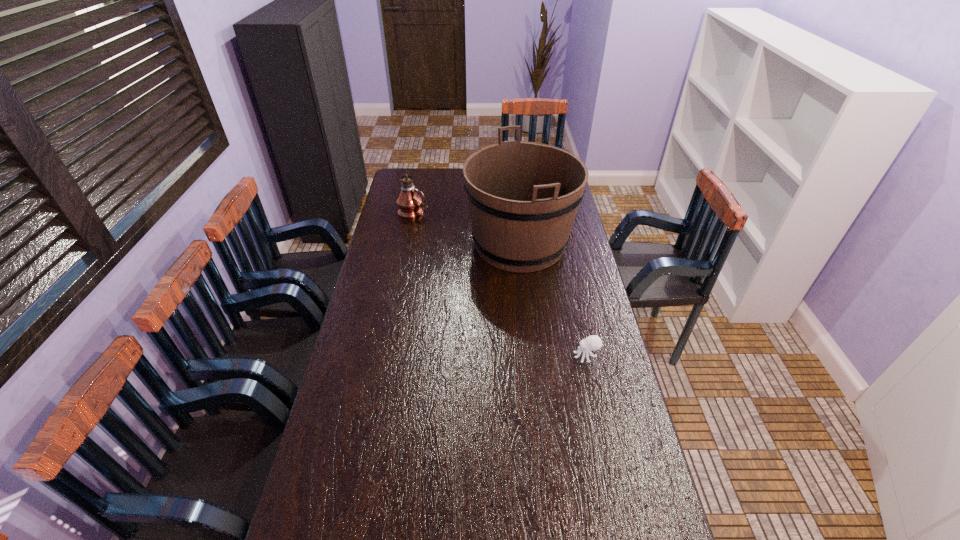
Find the location of a particular element. the tallest object is located at coordinates (523, 197).

Where is `the second shortest object`? the second shortest object is located at coordinates (410, 203).

Where is `the leftmost object`? The image size is (960, 540). the leftmost object is located at coordinates click(x=410, y=203).

You are a GUI agent. You are given a task and a screenshot of the screen. Output one action in this format:
    pyautogui.click(x=<x>, y=<y>)
    Task: Click on the shortest object
    The height and width of the screenshot is (540, 960).
    Given the screenshot: What is the action you would take?
    pyautogui.click(x=591, y=343)

You are a GUI agent. You are given a task and a screenshot of the screen. Output one action in this format:
    pyautogui.click(x=<x>, y=<y>)
    Task: Click on the nearest object
    
    Given the screenshot: What is the action you would take?
    pyautogui.click(x=591, y=343)

The image size is (960, 540). Find the location of `free space located 0.260m on the left of the bucket`. free space located 0.260m on the left of the bucket is located at coordinates (406, 244).

Image resolution: width=960 pixels, height=540 pixels. In order to click on vacant space situated on the right of the oil lamp in this screenshot , I will do `click(498, 211)`.

Locate an element on the screen. The width and height of the screenshot is (960, 540). vacant space situated on the front-facing side of the shortest object is located at coordinates (535, 356).

The image size is (960, 540). In order to click on free spot located 0.190m on the front-facing side of the shortest object in this screenshot , I will do `click(517, 356)`.

Find the location of `vacant space located on the front-facing side of the shortest object`. vacant space located on the front-facing side of the shortest object is located at coordinates (478, 356).